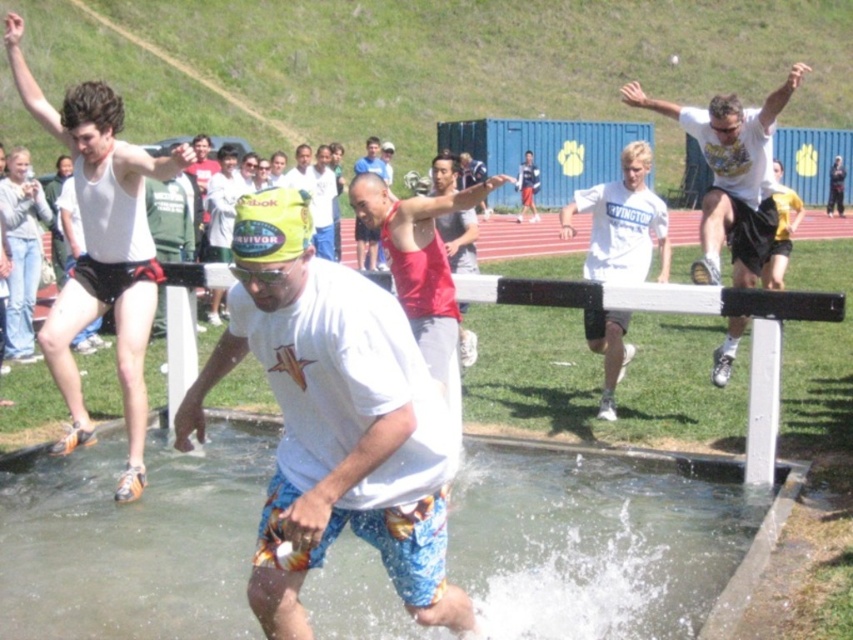
Measure the distance between point (306, 435) and camera.

Point (306, 435) and camera are 3.66 meters apart from each other.

Based on the photo, does white cotton t-shirt at center appear on the right side of red tank top at center?

No, white cotton t-shirt at center is not to the right of red tank top at center.

Is point (265, 196) positioned in front of point (463, 326)?

Yes.

I want to click on white cotton t-shirt at center, so click(x=334, y=420).

Between point (207, 378) and point (815, 320), which one is positioned behind?

Positioned behind is point (815, 320).

Is point (399, 586) farther from camera compared to point (717, 296)?

No, it is in front of (717, 296).

The image size is (853, 640). I want to click on white cotton t-shirt at center, so click(334, 420).

Who is more distant from viewer, (723, 544) or (54, 380)?

Point (54, 380)

Where is `clear water at puddle center`? The width and height of the screenshot is (853, 640). clear water at puddle center is located at coordinates (608, 540).